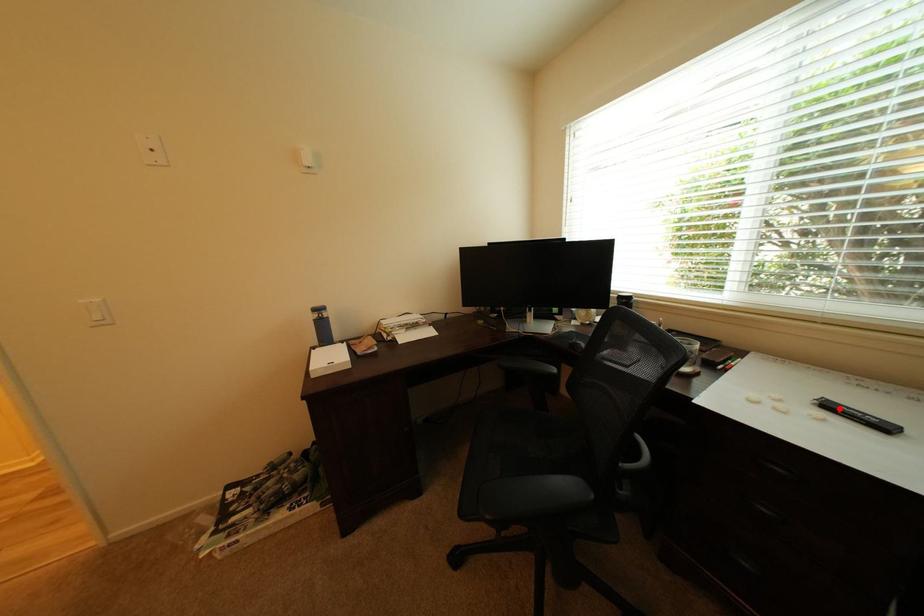
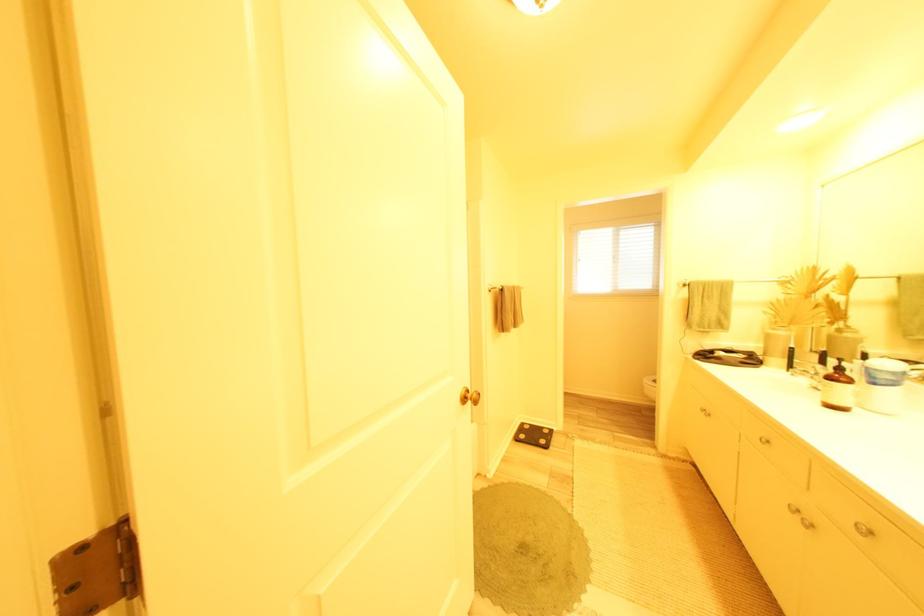
Question: I am providing you with two images of the same scene from different viewpoints. A red point is marked on the first image. Is the red point's position out of view in image 2?

Choices:
 (A) Yes
 (B) No

Answer: (A)